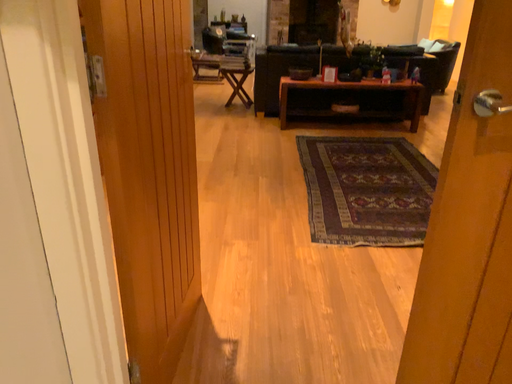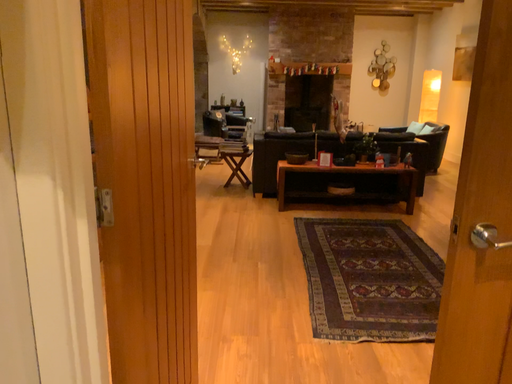
Question: Which way did the camera rotate in the video?

Choices:
 (A) rotated downward
 (B) rotated upward

Answer: (B)